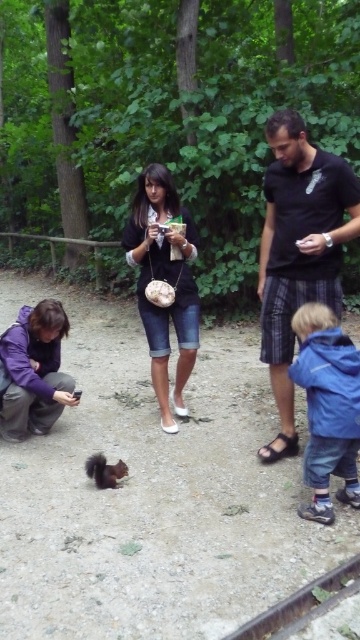
You are a photographer trying to capture a closeup of the squirrel. You have two items in your bag, the black cotton shirt at center and the blue fleece jacket at lower right. Which item should you use to cover your camera lens if you want to block more light?

The black cotton shirt at center is larger in size than the blue fleece jacket at lower right, so it would be better to use the black cotton shirt at center to block more light since it is bigger.

You are standing in the park and want to find the blue fleece jacket at lower right. According to the coordinates provided, where should you look relative to the center of the image?

The blue fleece jacket at lower right is located at coordinates approximately 64 percent to the right and 91 percent down from the top left corner of the image.

You are standing in the park and see the blue fleece jacket at lower right and the purple fabric jacket at lower left. Which jacket is nearer to you?

The blue fleece jacket at lower right is closer to the viewer than the purple fabric jacket at lower left.